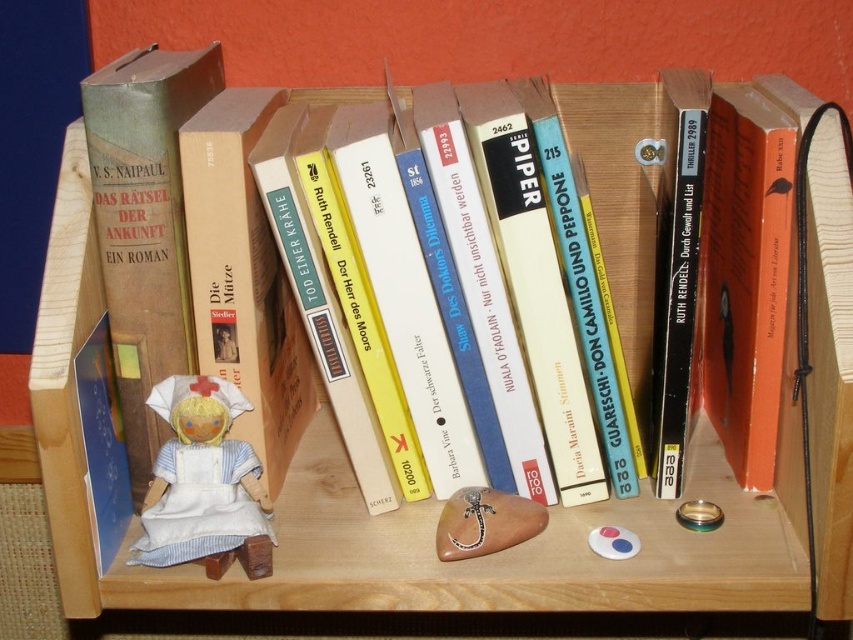
Is white fabric doll at center above brown wooden spoon at center?

Yes, white fabric doll at center is above brown wooden spoon at center.

Does white fabric doll at center come in front of brown wooden spoon at center?

Yes, white fabric doll at center is closer to the viewer.

Describe the element at coordinates (202, 483) in the screenshot. I see `white fabric doll at center` at that location.

Locate an element on the screen. white fabric doll at center is located at coordinates (202, 483).